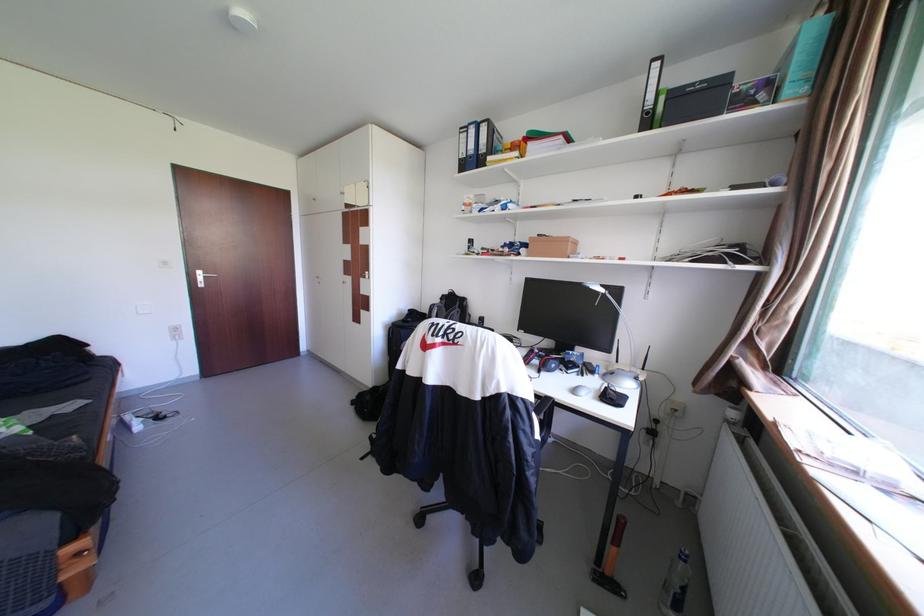
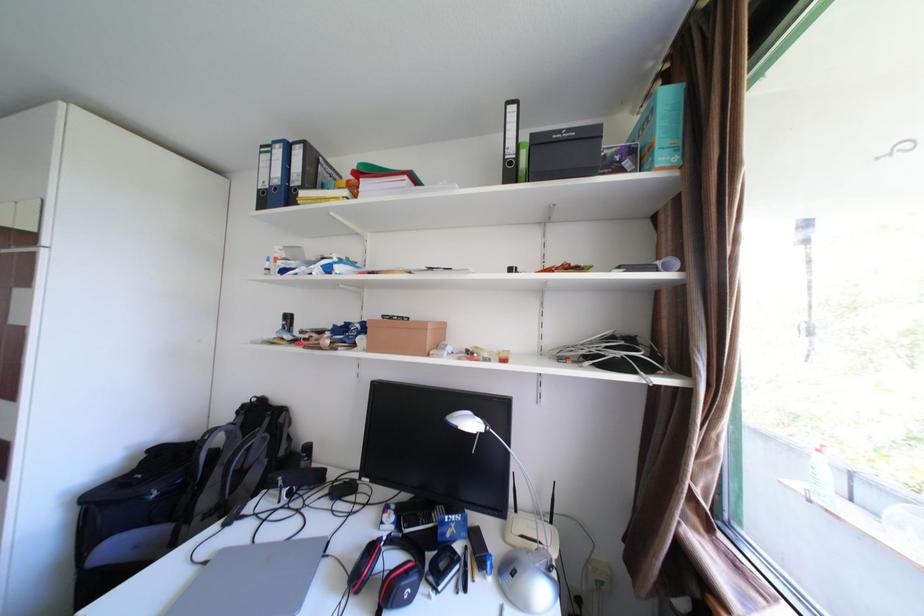
The images are taken continuously from a first-person perspective. In which direction are you moving?

The cameraman moved toward right, forward.